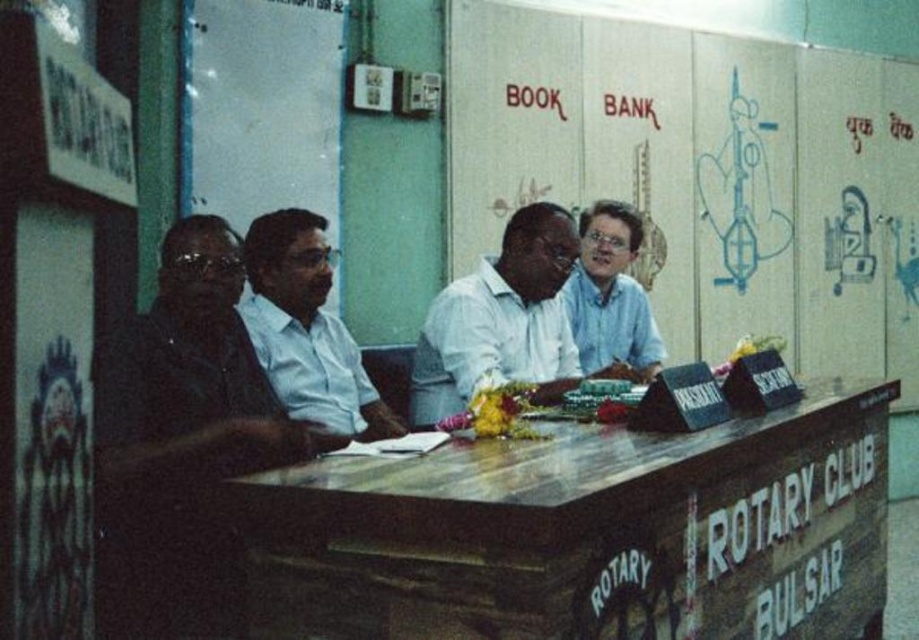
You are standing at the point labeled point (309, 300) and want to walk to the point labeled point (668, 499). Which direction should you face to move towards your destination?

You should face forward because point (668, 499) is in front of point (309, 300).